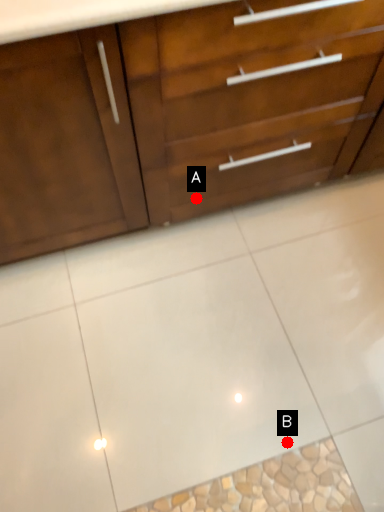
Question: Two points are circled on the image, labeled by A and B beside each circle. Which point appears farthest from the camera in this image?

Choices:
 (A) A is further
 (B) B is further

Answer: (A)